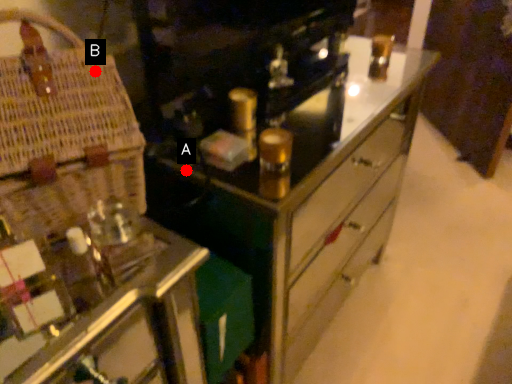
Question: Two points are circled on the image, labeled by A and B beside each circle. Which of the following is the closest to the observer?

Choices:
 (A) A is closer
 (B) B is closer

Answer: (B)